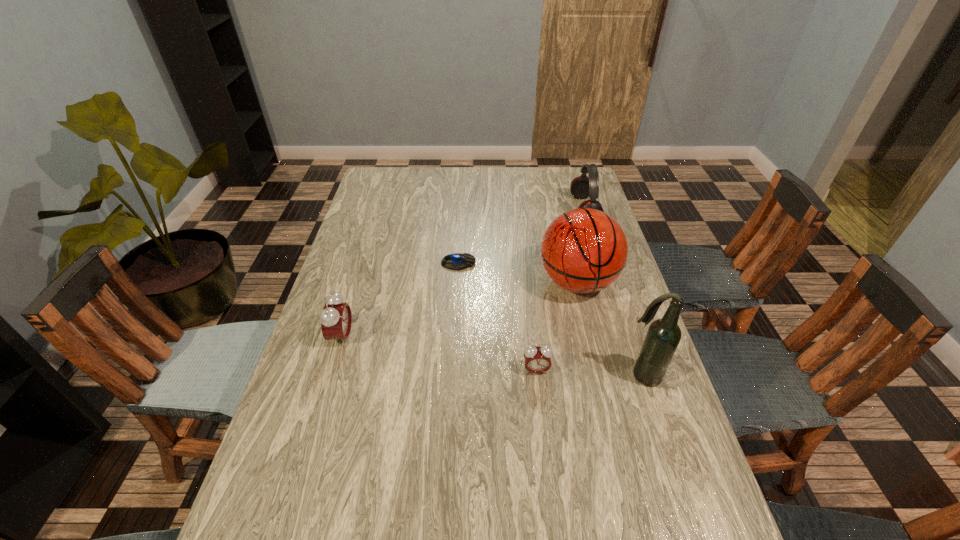
Where is `free space located on the clock face of the leftmost object`? free space located on the clock face of the leftmost object is located at coordinates (392, 337).

Identify the location of vacant space located 0.280m on the clock face of the shorter alarm clock. (550, 491).

I want to click on blank area located on the button side of the computer mouse, so click(x=593, y=263).

The height and width of the screenshot is (540, 960). I want to click on free space located 0.270m on the ear cups of the third tallest object, so click(500, 210).

This screenshot has width=960, height=540. I want to click on vacant space located on the ear cups of the third tallest object, so click(470, 210).

This screenshot has width=960, height=540. In order to click on free location located 0.370m on the ear cups of the third tallest object in this screenshot , I will do click(x=473, y=210).

Image resolution: width=960 pixels, height=540 pixels. I want to click on vacant space located 0.200m on the side with spill of the basketball, so click(x=598, y=369).

You are a GUI agent. You are given a task and a screenshot of the screen. Output one action in this format:
    pyautogui.click(x=<x>, y=<y>)
    Task: Click on the vacant position located on the back of the beer bottle
    The image size is (960, 540).
    Given the screenshot: What is the action you would take?
    pyautogui.click(x=606, y=264)

Identify the location of object located in the far edge section of the desktop. (581, 187).

At what (x,y) coordinates should I click in order to perform the action: click on object present at the left edge. Please return your answer as a coordinate pair (x, y). The height and width of the screenshot is (540, 960). Looking at the image, I should click on point(336,318).